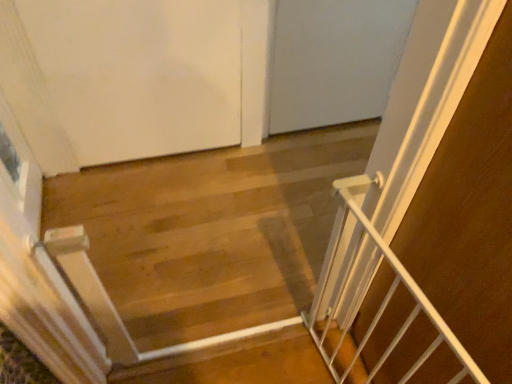
Question: Is white metal gate at center positioned far away from white matte door at upper left?

Choices:
 (A) no
 (B) yes

Answer: (A)

Question: Does white metal gate at center have a smaller size compared to white matte door at upper left?

Choices:
 (A) yes
 (B) no

Answer: (A)

Question: Does white metal gate at center lie in front of white matte door at upper left?

Choices:
 (A) yes
 (B) no

Answer: (A)

Question: Does white metal gate at center have a lesser width compared to white matte door at upper left?

Choices:
 (A) yes
 (B) no

Answer: (A)

Question: Can you confirm if white metal gate at center is positioned to the left of white matte door at upper left?

Choices:
 (A) no
 (B) yes

Answer: (A)

Question: In terms of width, does white metal gate at right look wider or thinner when compared to white metal gate at center?

Choices:
 (A) wide
 (B) thin

Answer: (A)

Question: Is white metal gate at right inside or outside of white metal gate at center?

Choices:
 (A) inside
 (B) outside

Answer: (B)

Question: From the image's perspective, is white metal gate at right above or below white metal gate at center?

Choices:
 (A) below
 (B) above

Answer: (A)

Question: Is white metal gate at right in front of or behind white metal gate at center in the image?

Choices:
 (A) front
 (B) behind

Answer: (A)

Question: Based on their sizes in the image, would you say white metal gate at right is bigger or smaller than white matte door at upper left?

Choices:
 (A) big
 (B) small

Answer: (B)

Question: In the image, is white metal gate at right positioned in front of or behind white matte door at upper left?

Choices:
 (A) front
 (B) behind

Answer: (A)

Question: Is white metal gate at right inside the boundaries of white matte door at upper left, or outside?

Choices:
 (A) inside
 (B) outside

Answer: (B)

Question: From their relative heights in the image, would you say white metal gate at right is taller or shorter than white matte door at upper left?

Choices:
 (A) short
 (B) tall

Answer: (A)

Question: In the image, is white metal gate at center on the left side or the right side of white matte door at upper left?

Choices:
 (A) right
 (B) left

Answer: (A)

Question: Considering the positions of white metal gate at center and white matte door at upper left in the image, is white metal gate at center wider or thinner than white matte door at upper left?

Choices:
 (A) wide
 (B) thin

Answer: (B)